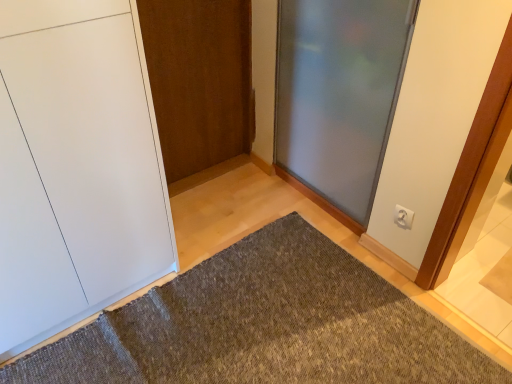
Question: From the image's perspective, is white plastic electric outlet at upper right positioned above or below textured gray doormat at center?

Choices:
 (A) above
 (B) below

Answer: (A)

Question: Does point (413, 215) appear closer or farther from the camera than point (125, 347)?

Choices:
 (A) closer
 (B) farther

Answer: (B)

Question: Which object is the farthest from the textured gray doormat at center?

Choices:
 (A) wooden door at center, which is counted as the 2th door, starting from the right
 (B) white plastic electric outlet at upper right
 (C) frosted glass door at center, which is the 1th door in right-to-left order
 (D) white matte door at left, which appears as the 3th door when viewed from the right

Answer: (A)

Question: Which of these objects is positioned farthest from the wooden door at center, which is counted as the 2th door, starting from the right?

Choices:
 (A) white matte door at left, which appears as the 3th door when viewed from the right
 (B) textured gray doormat at center
 (C) white plastic electric outlet at upper right
 (D) frosted glass door at center, which appears as the 3th door when viewed from the left

Answer: (C)